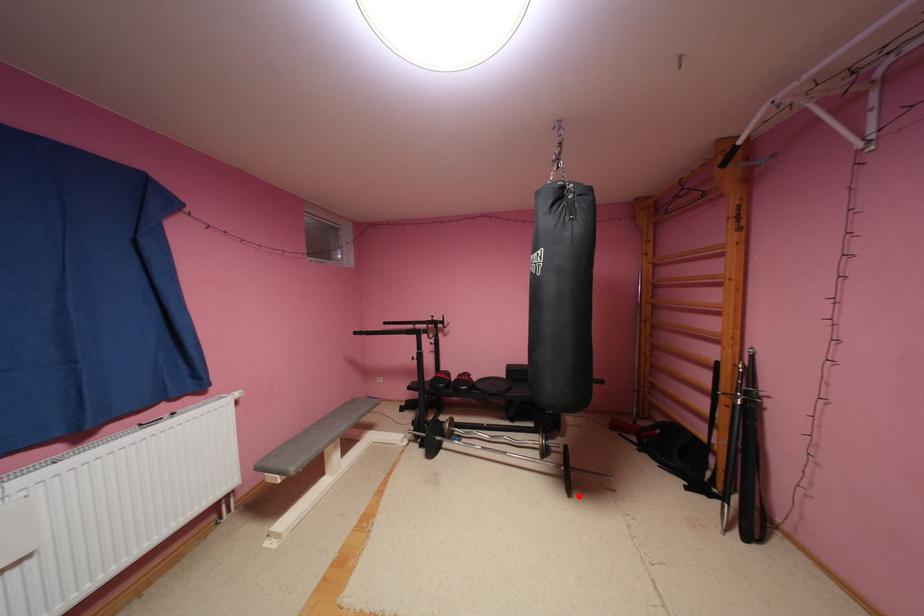
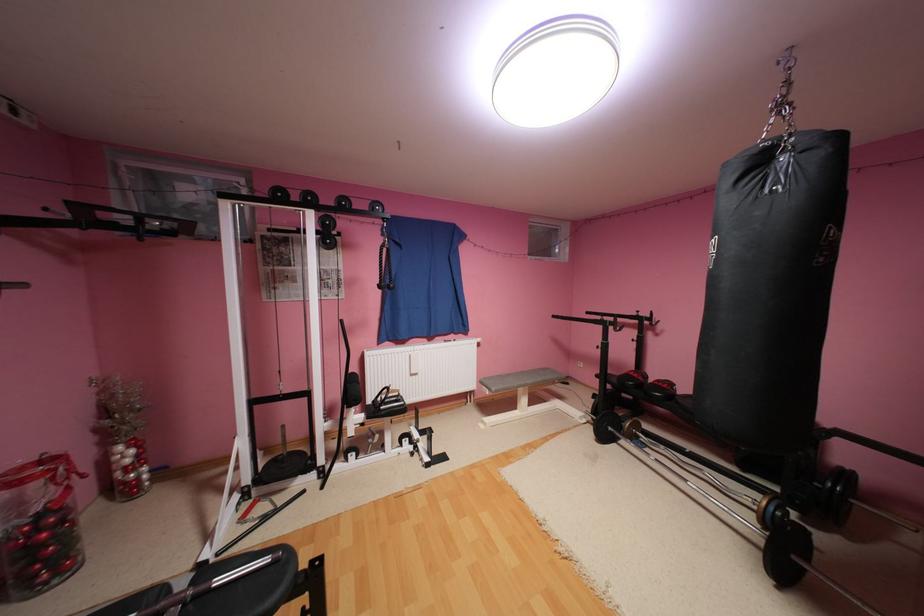
Find the pixel in the second image that matches the highlighted location in the first image.

(787, 588)